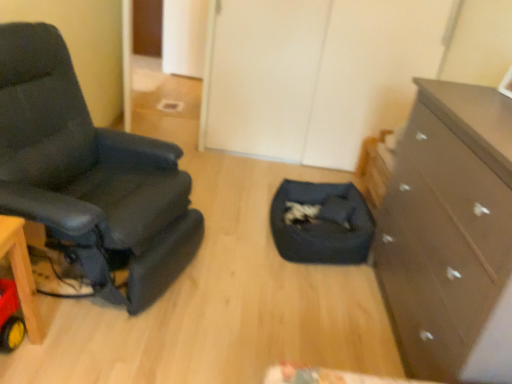
In order to click on dark blue fabric pet bed at center in this screenshot , I will do pyautogui.click(x=321, y=223).

Describe the element at coordinates (450, 236) in the screenshot. I see `dark brown wooden chest of drawers at right` at that location.

Where is `dark blue fabric pet bed at center`? The image size is (512, 384). dark blue fabric pet bed at center is located at coordinates (321, 223).

Based on their sizes in the image, would you say dark brown wooden chest of drawers at right is bigger or smaller than dark blue fabric pet bed at center?

dark brown wooden chest of drawers at right is bigger than dark blue fabric pet bed at center.

Who is more distant, dark brown wooden chest of drawers at right or dark blue fabric pet bed at center?

Positioned behind is dark blue fabric pet bed at center.

Is the surface of dark brown wooden chest of drawers at right in direct contact with dark blue fabric pet bed at center?

There is a gap between dark brown wooden chest of drawers at right and dark blue fabric pet bed at center.

Which object is positioned more to the right, dark brown wooden chest of drawers at right or dark blue fabric pet bed at center?

Positioned to the right is dark brown wooden chest of drawers at right.

From the image's perspective, is black leather chair at left positioned above or below dark blue fabric pet bed at center?

Based on their image positions, black leather chair at left is located above dark blue fabric pet bed at center.

Would you say dark blue fabric pet bed at center is part of black leather chair at left's contents?

Definitely not — dark blue fabric pet bed at center is not inside black leather chair at left.

Which object is thinner, black leather chair at left or dark blue fabric pet bed at center?

Thinner between the two is dark blue fabric pet bed at center.

Is black leather chair at left positioned with its back to dark blue fabric pet bed at center?

That's not correct — black leather chair at left is not looking away from dark blue fabric pet bed at center.

Looking at this image, does dark brown wooden chest of drawers at right lie behind black leather chair at left?

No, it is not.

Would you say dark brown wooden chest of drawers at right is outside black leather chair at left?

Yes, dark brown wooden chest of drawers at right is located beyond the bounds of black leather chair at left.

Is dark brown wooden chest of drawers at right facing towards black leather chair at left?

Yes, dark brown wooden chest of drawers at right is facing black leather chair at left.

Looking at the image, does dark brown wooden chest of drawers at right seem bigger or smaller compared to black leather chair at left?

Clearly, dark brown wooden chest of drawers at right is smaller in size than black leather chair at left.

From a real-world perspective, is black leather chair at left physically located above or below dark brown wooden chest of drawers at right?

In terms of real-world spatial position, black leather chair at left is above dark brown wooden chest of drawers at right.

Which is less distant, (54, 151) or (494, 245)?

The point (494, 245) is closer to the camera.

From the picture: Is black leather chair at left positioned behind dark brown wooden chest of drawers at right?

That is True.

Consider the image. From the image's perspective, between black leather chair at left and dark brown wooden chest of drawers at right, who is located below?

dark brown wooden chest of drawers at right.

Is dark blue fabric pet bed at center placed right next to dark brown wooden chest of drawers at right?

There is a gap between dark blue fabric pet bed at center and dark brown wooden chest of drawers at right.

Is dark blue fabric pet bed at center spatially inside dark brown wooden chest of drawers at right, or outside of it?

dark blue fabric pet bed at center lies outside dark brown wooden chest of drawers at right.

Where is `the footrest above the dark brown wooden chest of drawers at right (from the image's perspective)`? the footrest above the dark brown wooden chest of drawers at right (from the image's perspective) is located at coordinates (321, 223).

Between dark blue fabric pet bed at center and dark brown wooden chest of drawers at right, which one is positioned behind?

dark blue fabric pet bed at center is further from the camera.

Does dark blue fabric pet bed at center have a greater height compared to black leather chair at left?

Incorrect, the height of dark blue fabric pet bed at center is not larger of that of black leather chair at left.

How many degrees apart are the facing directions of dark blue fabric pet bed at center and black leather chair at left?

159 degrees.

Considering the positions of objects dark blue fabric pet bed at center and black leather chair at left in the image provided, who is behind, dark blue fabric pet bed at center or black leather chair at left?

Positioned behind is dark blue fabric pet bed at center.

From the picture: How far apart are dark blue fabric pet bed at center and black leather chair at left?

dark blue fabric pet bed at center is 85.80 centimeters away from black leather chair at left.

Where is `the chest of drawers that is above the dark blue fabric pet bed at center (from a real-world perspective)`? the chest of drawers that is above the dark blue fabric pet bed at center (from a real-world perspective) is located at coordinates (450, 236).

Where is `chair in front of the dark blue fabric pet bed at center`? chair in front of the dark blue fabric pet bed at center is located at coordinates (89, 175).

Based on their spatial positions, is dark blue fabric pet bed at center or dark brown wooden chest of drawers at right closer to black leather chair at left?

dark blue fabric pet bed at center is closer to black leather chair at left.

When comparing their distances from dark brown wooden chest of drawers at right, does black leather chair at left or dark blue fabric pet bed at center seem closer?

dark blue fabric pet bed at center is closer to dark brown wooden chest of drawers at right.

Based on their spatial positions, is black leather chair at left or dark brown wooden chest of drawers at right closer to dark blue fabric pet bed at center?

dark brown wooden chest of drawers at right is closer to dark blue fabric pet bed at center.

Looking at the image, which one is located closer to black leather chair at left, dark brown wooden chest of drawers at right or dark blue fabric pet bed at center?

dark blue fabric pet bed at center is closer to black leather chair at left.

Estimate the real-world distances between objects in this image. Which object is closer to dark brown wooden chest of drawers at right, dark blue fabric pet bed at center or black leather chair at left?

The object closer to dark brown wooden chest of drawers at right is dark blue fabric pet bed at center.

Estimate the real-world distances between objects in this image. Which object is closer to dark blue fabric pet bed at center, dark brown wooden chest of drawers at right or black leather chair at left?

dark brown wooden chest of drawers at right is positioned closer to the anchor dark blue fabric pet bed at center.

Find the location of a particular element. footrest between black leather chair at left and dark brown wooden chest of drawers at right in the horizontal direction is located at coordinates (321, 223).